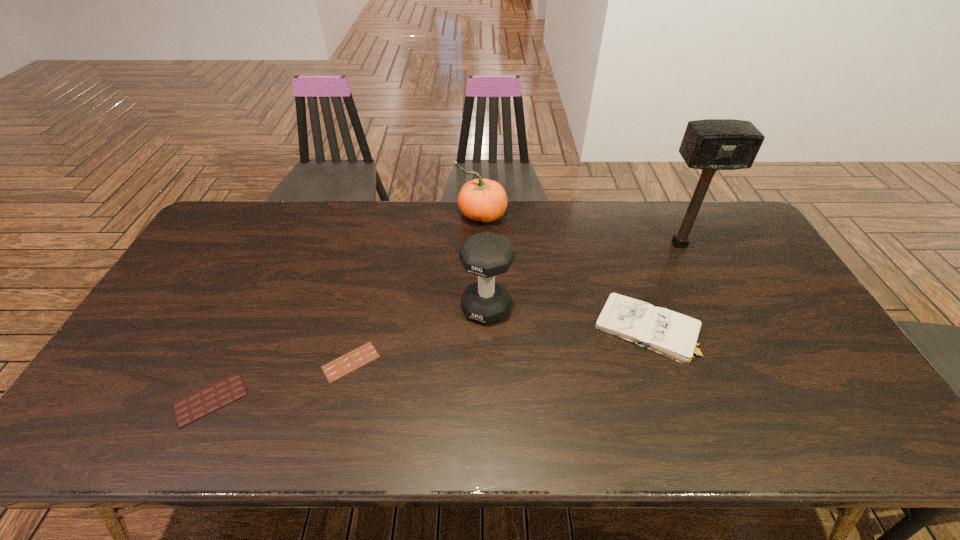
This screenshot has height=540, width=960. In order to click on empty location between the farthest object and the right chocolate bar in this screenshot , I will do point(417,289).

Choose which object is the fifth nearest neighbor to the third shortest object. Please provide its 2D coordinates. Your answer should be formatted as a tuple, i.e. [(x, y)], where the tuple contains the x and y coordinates of a point satisfying the conditions above.

[(191, 408)]

Where is `the third closest object to the shorter chocolate bar`? The image size is (960, 540). the third closest object to the shorter chocolate bar is located at coordinates (484, 200).

Where is `free location that satisfies the following two spatial constraints: 1. on the back side of the right chocolate bar; 2. on the right side of the notebook`? The width and height of the screenshot is (960, 540). free location that satisfies the following two spatial constraints: 1. on the back side of the right chocolate bar; 2. on the right side of the notebook is located at coordinates (359, 329).

I want to click on free space in the image that satisfies the following two spatial constraints: 1. on the front side of the dumbbell; 2. on the right side of the farthest object, so click(x=483, y=308).

Identify the location of free space that satisfies the following two spatial constraints: 1. on the back side of the shortest object; 2. on the left side of the farthest object. This screenshot has height=540, width=960. (387, 215).

The height and width of the screenshot is (540, 960). I want to click on vacant area in the image that satisfies the following two spatial constraints: 1. on the back side of the notebook; 2. on the right side of the mallet, so click(618, 244).

I want to click on vacant space that satisfies the following two spatial constraints: 1. on the back side of the dumbbell; 2. on the left side of the fifth object from right to left, so click(x=364, y=308).